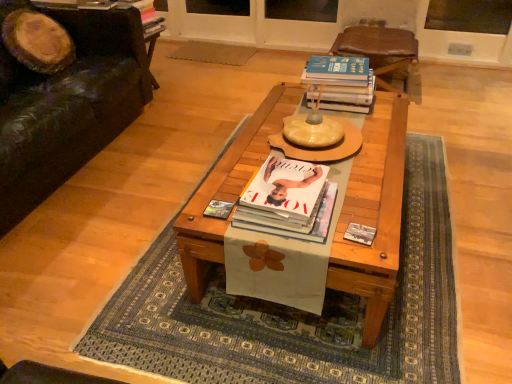
Locate an element on the screen. This screenshot has height=384, width=512. empty space that is to the right of black leather couch at left is located at coordinates (168, 154).